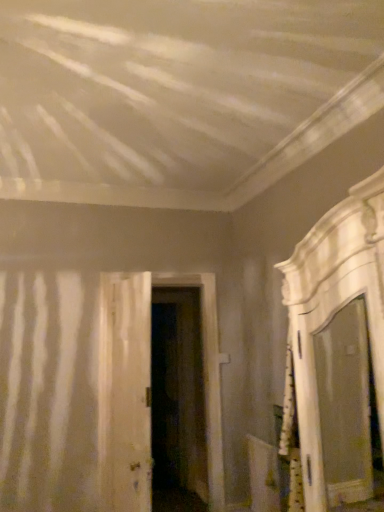
What is the approximate height of dark wood door at center, placed as the first door when sorted from back to front?

It is 6.84 feet.

Where is `white glossy mirror at right`? This screenshot has width=384, height=512. white glossy mirror at right is located at coordinates [x=338, y=353].

What do you see at coordinates (338, 353) in the screenshot?
I see `white glossy mirror at right` at bounding box center [338, 353].

In order to face white wood door at center, arranged as the third door when viewed from the back, should I rotate leftwards or rightwards?

A 8.348 degree turn to the left will do.

Where is `white wood door at center, which is the second door from back to front`? The height and width of the screenshot is (512, 384). white wood door at center, which is the second door from back to front is located at coordinates (146, 387).

Is point (360, 432) less distant than point (177, 421)?

Yes, it is.

Is white glossy mirror at right positioned with its back to dark wood door at center, the third door from the front?

No, white glossy mirror at right's orientation is not away from dark wood door at center, the third door from the front.

From the image's perspective, which is below, white glossy mirror at right or dark wood door at center, placed as the first door when sorted from back to front?

dark wood door at center, placed as the first door when sorted from back to front.

Considering the positions of objects white glossy mirror at right and dark wood door at center, placed as the first door when sorted from back to front, in the image provided, who is in front, white glossy mirror at right or dark wood door at center, placed as the first door when sorted from back to front,?

white glossy mirror at right is closer to the camera.

From the image's perspective, which object appears higher, white wood door at center, which ranks as the 2th door in front-to-back order, or white wood door at center, arranged as the third door when viewed from the back?

white wood door at center, arranged as the third door when viewed from the back.

Is white wood door at center, which ranks as the 2th door in front-to-back order, further to the viewer compared to white wood door at center, arranged as the third door when viewed from the back?

Yes, white wood door at center, which ranks as the 2th door in front-to-back order, is further from the camera.

Based on their sizes in the image, would you say white wood door at center, which ranks as the 2th door in front-to-back order, is bigger or smaller than white wood door at center, arranged as the third door when viewed from the back?

Clearly, white wood door at center, which ranks as the 2th door in front-to-back order, is larger in size than white wood door at center, arranged as the third door when viewed from the back.

Considering the relative sizes of white wood door at center, which is the second door from back to front, and white glossy mirror at right in the image provided, is white wood door at center, which is the second door from back to front, taller than white glossy mirror at right?

Correct, white wood door at center, which is the second door from back to front, is much taller as white glossy mirror at right.

Which object is closer to the camera taking this photo, white wood door at center, which ranks as the 2th door in front-to-back order, or white glossy mirror at right?

white glossy mirror at right is in front.

This screenshot has width=384, height=512. Find the location of `door that is the 2nd one when counting backward from the white glossy mirror at right`. door that is the 2nd one when counting backward from the white glossy mirror at right is located at coordinates (146, 387).

Is white wood door at center, which ranks as the 2th door in front-to-back order, facing away from white glossy mirror at right?

No, white wood door at center, which ranks as the 2th door in front-to-back order,'s orientation is not away from white glossy mirror at right.

At what (x,y) coordinates should I click in order to perform the action: click on door that is on the left side of white wood door at center, which ranks as the 2th door in front-to-back order. Please return your answer as a coordinate pair (x, y). This screenshot has height=512, width=384. Looking at the image, I should click on (130, 391).

Are white wood door at center, arranged as the third door when viewed from the back, and white wood door at center, which is the second door from back to front, far apart?

white wood door at center, arranged as the third door when viewed from the back, is actually quite close to white wood door at center, which is the second door from back to front.

Would you say white wood door at center, arranged as the third door when viewed from the back, is to the left or to the right of white wood door at center, which is the second door from back to front, in the picture?

Clearly, white wood door at center, arranged as the third door when viewed from the back, is on the left of white wood door at center, which is the second door from back to front, in the image.

From a real-world perspective, is white wood door at center, marked as the 1th door in a front-to-back arrangement, positioned over white wood door at center, which is the second door from back to front, based on gravity?

Yes, from a real-world perspective, white wood door at center, marked as the 1th door in a front-to-back arrangement, is on top of white wood door at center, which is the second door from back to front.

From the image's perspective, is dark wood door at center, the third door from the front, located above or below white glossy mirror at right?

dark wood door at center, the third door from the front, is below white glossy mirror at right.

Between dark wood door at center, placed as the first door when sorted from back to front, and white glossy mirror at right, which one appears on the right side from the viewer's perspective?

white glossy mirror at right.

Is white glossy mirror at right in front of white wood door at center, arranged as the third door when viewed from the back?

Yes, the depth of white glossy mirror at right is less than that of white wood door at center, arranged as the third door when viewed from the back.

From a real-world perspective, is white glossy mirror at right on top of white wood door at center, marked as the 1th door in a front-to-back arrangement?

Indeed, from a real-world perspective, white glossy mirror at right stands above white wood door at center, marked as the 1th door in a front-to-back arrangement.

Which of these two, white glossy mirror at right or white wood door at center, arranged as the third door when viewed from the back, stands shorter?

white glossy mirror at right.

Who is shorter, white wood door at center, marked as the 1th door in a front-to-back arrangement, or dark wood door at center, placed as the first door when sorted from back to front?

Standing shorter between the two is white wood door at center, marked as the 1th door in a front-to-back arrangement.

From a real-world perspective, is white wood door at center, marked as the 1th door in a front-to-back arrangement, above or below dark wood door at center, the third door from the front?

From a real-world perspective, white wood door at center, marked as the 1th door in a front-to-back arrangement, is physically above dark wood door at center, the third door from the front.

Considering the relative sizes of white wood door at center, marked as the 1th door in a front-to-back arrangement, and dark wood door at center, the third door from the front, in the image provided, is white wood door at center, marked as the 1th door in a front-to-back arrangement, thinner than dark wood door at center, the third door from the front,?

Yes.

From the image's perspective, does white wood door at center, marked as the 1th door in a front-to-back arrangement, appear higher than dark wood door at center, the third door from the front?

Yes.

Identify the location of the 3rd door behind the white glossy mirror at right. The image size is (384, 512). (178, 398).

This screenshot has width=384, height=512. In order to click on door that is the 1st object directly below the white wood door at center, arranged as the third door when viewed from the back (from a real-world perspective) in this screenshot , I will do point(146,387).

Considering their positions, is white glossy mirror at right positioned further to white wood door at center, arranged as the third door when viewed from the back, than white wood door at center, which ranks as the 2th door in front-to-back order?

white glossy mirror at right is positioned further to the anchor white wood door at center, arranged as the third door when viewed from the back.

When comparing their distances from white glossy mirror at right, does white wood door at center, which ranks as the 2th door in front-to-back order, or dark wood door at center, placed as the first door when sorted from back to front, seem further?

dark wood door at center, placed as the first door when sorted from back to front, is positioned further to the anchor white glossy mirror at right.

When comparing their distances from dark wood door at center, the third door from the front, does white wood door at center, which is the second door from back to front, or white glossy mirror at right seem closer?

Among the two, white wood door at center, which is the second door from back to front, is located nearer to dark wood door at center, the third door from the front.

Which object lies nearer to the anchor point dark wood door at center, the third door from the front, white wood door at center, arranged as the third door when viewed from the back, or white glossy mirror at right?

white wood door at center, arranged as the third door when viewed from the back.

Based on their spatial positions, is white glossy mirror at right or dark wood door at center, placed as the first door when sorted from back to front, further from white wood door at center, arranged as the third door when viewed from the back?

white glossy mirror at right is further to white wood door at center, arranged as the third door when viewed from the back.

Estimate the real-world distances between objects in this image. Which object is further from white glossy mirror at right, white wood door at center, arranged as the third door when viewed from the back, or white wood door at center, which is the second door from back to front?

Based on the image, white wood door at center, arranged as the third door when viewed from the back, appears to be further to white glossy mirror at right.

Which object lies nearer to the anchor point white glossy mirror at right, white wood door at center, arranged as the third door when viewed from the back, or dark wood door at center, the third door from the front?

dark wood door at center, the third door from the front.

Based on their spatial positions, is white wood door at center, arranged as the third door when viewed from the back, or white wood door at center, which ranks as the 2th door in front-to-back order, further from dark wood door at center, the third door from the front?

Among the two, white wood door at center, arranged as the third door when viewed from the back, is located further to dark wood door at center, the third door from the front.

Image resolution: width=384 pixels, height=512 pixels. I want to click on door located between white wood door at center, marked as the 1th door in a front-to-back arrangement, and dark wood door at center, the third door from the front, in the depth direction, so click(146, 387).

Identify the location of door located between white glossy mirror at right and white wood door at center, which ranks as the 2th door in front-to-back order, in the depth direction. (130, 391).